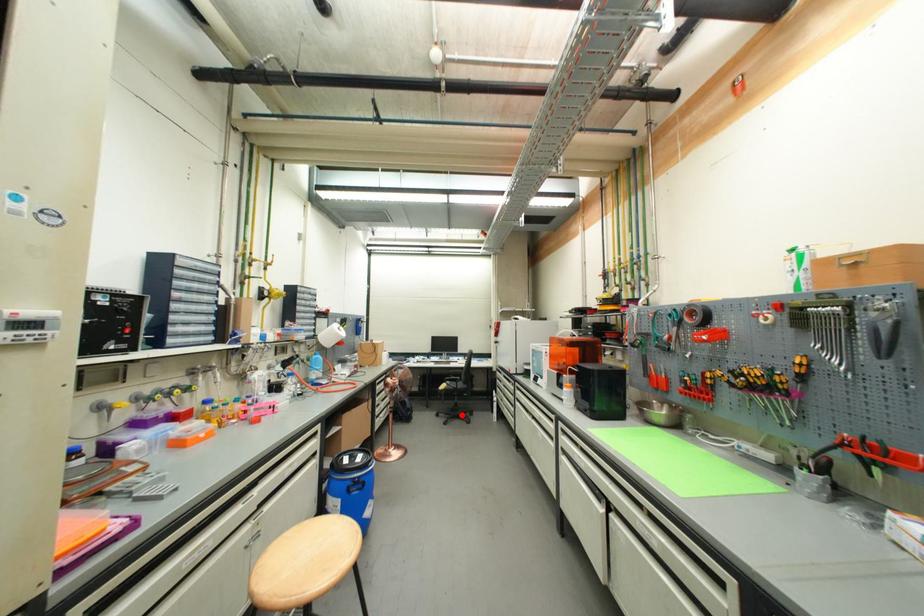
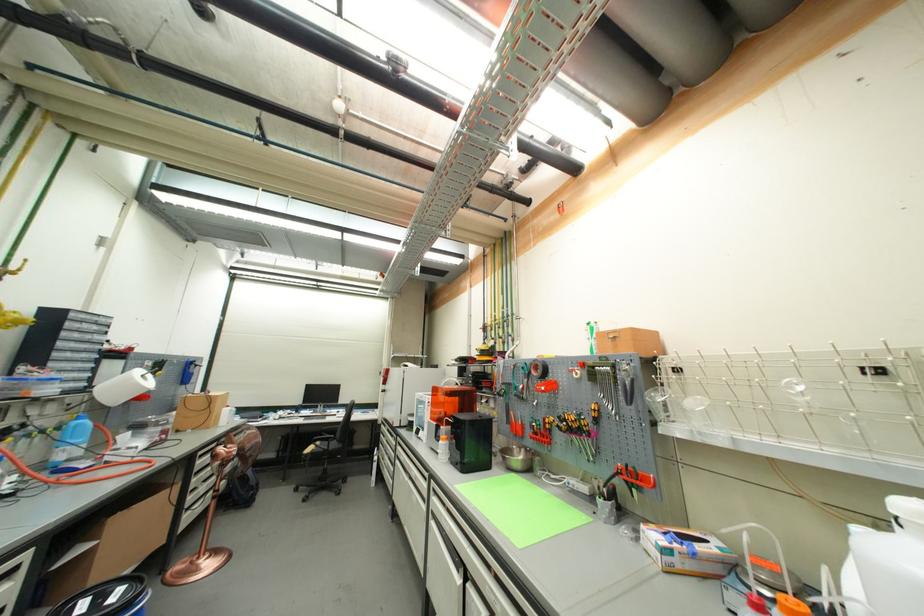
Question: I am providing you with two images of the same scene from different viewpoints. In image1, a red point is highlighted. Considering the same 3D point in image2, which of the following is correct?

Choices:
 (A) It is closer
 (B) It is farther

Answer: (A)